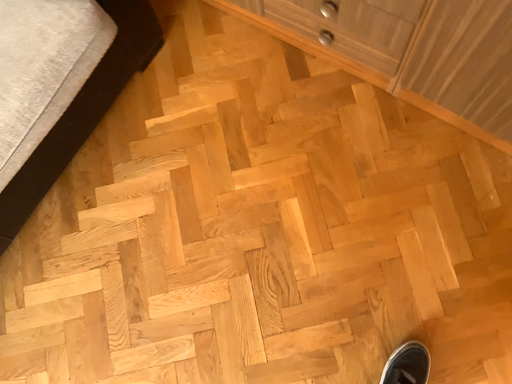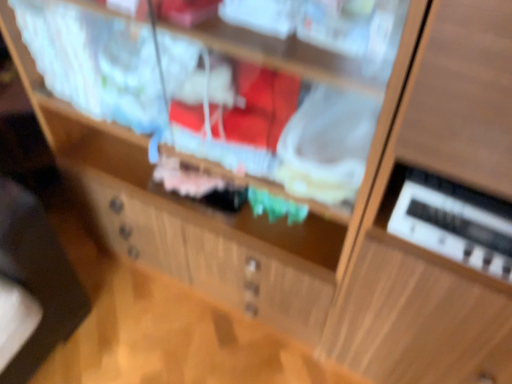
Question: Which way did the camera rotate in the video?

Choices:
 (A) rotated right
 (B) rotated left

Answer: (A)